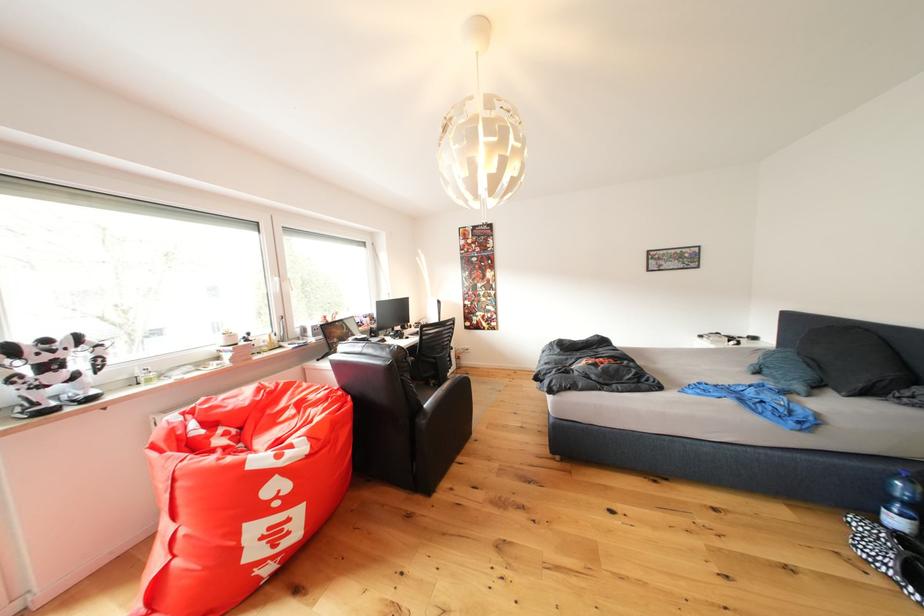
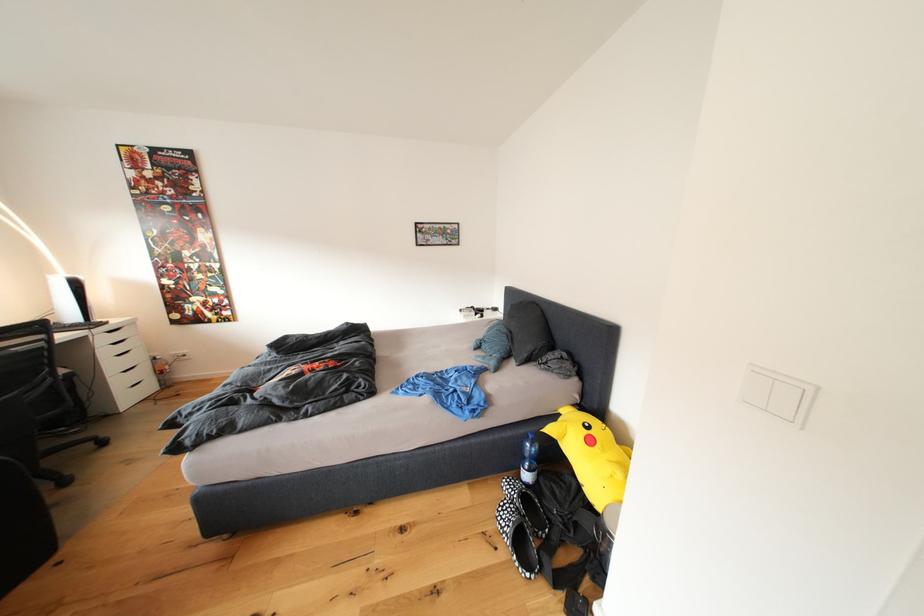
The point at (x=710, y=341) is marked in the first image. Where is the corresponding point in the second image?

(469, 315)